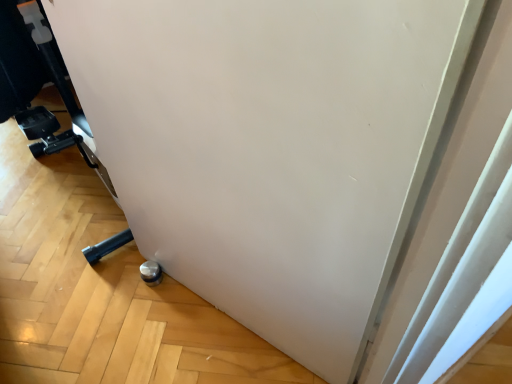
Where is `metallic silver caster at lower left`? metallic silver caster at lower left is located at coordinates (34, 79).

What do you see at coordinates (34, 79) in the screenshot?
I see `metallic silver caster at lower left` at bounding box center [34, 79].

You are a GUI agent. You are given a task and a screenshot of the screen. Output one action in this format:
    pyautogui.click(x=<x>, y=<y>)
    Task: Click on the metallic silver wheel at lower left
    The height and width of the screenshot is (384, 512).
    Given the screenshot: What is the action you would take?
    pyautogui.click(x=151, y=273)

This screenshot has width=512, height=384. What do you see at coordinates (151, 273) in the screenshot? I see `metallic silver wheel at lower left` at bounding box center [151, 273].

The height and width of the screenshot is (384, 512). Find the location of `metallic silver caster at lower left`. metallic silver caster at lower left is located at coordinates (34, 79).

Considering the relative positions of metallic silver caster at lower left and metallic silver wheel at lower left in the image provided, is metallic silver caster at lower left to the left or to the right of metallic silver wheel at lower left?

In the image, metallic silver caster at lower left appears on the left side of metallic silver wheel at lower left.

Considering the positions of objects metallic silver caster at lower left and metallic silver wheel at lower left in the image provided, who is behind, metallic silver caster at lower left or metallic silver wheel at lower left?

metallic silver wheel at lower left is further from the camera.

Is point (55, 68) more distant than point (142, 278)?

That is True.

From the image's perspective, is metallic silver caster at lower left above metallic silver wheel at lower left?

Yes, from the image's perspective, metallic silver caster at lower left is over metallic silver wheel at lower left.

From a real-world perspective, which object stands above the other?

metallic silver caster at lower left.

Which of these two, metallic silver caster at lower left or metallic silver wheel at lower left, is thinner?

With smaller width is metallic silver wheel at lower left.

Considering the sizes of metallic silver caster at lower left and metallic silver wheel at lower left in the image, is metallic silver caster at lower left taller or shorter than metallic silver wheel at lower left?

Clearly, metallic silver caster at lower left is taller compared to metallic silver wheel at lower left.

Between metallic silver caster at lower left and metallic silver wheel at lower left, which one has smaller size?

Smaller between the two is metallic silver wheel at lower left.

Which is correct: metallic silver caster at lower left is inside metallic silver wheel at lower left, or outside of it?

metallic silver caster at lower left exists outside the volume of metallic silver wheel at lower left.

From the picture: Is there a large distance between metallic silver caster at lower left and metallic silver wheel at lower left?

That's not correct — metallic silver caster at lower left is a little close to metallic silver wheel at lower left.

Could you tell me if metallic silver caster at lower left is turned towards metallic silver wheel at lower left?

No, metallic silver caster at lower left does not turn towards metallic silver wheel at lower left.

Image resolution: width=512 pixels, height=384 pixels. In order to click on furniture above the metallic silver wheel at lower left (from the image's perspective) in this screenshot , I will do `click(34, 79)`.

Between metallic silver wheel at lower left and metallic silver caster at lower left, which one appears on the right side from the viewer's perspective?

From the viewer's perspective, metallic silver wheel at lower left appears more on the right side.

Is metallic silver wheel at lower left in front of or behind metallic silver caster at lower left in the image?

metallic silver wheel at lower left is positioned farther from the viewer than metallic silver caster at lower left.

Is point (158, 273) closer to camera compared to point (73, 112)?

Yes, point (158, 273) is closer to viewer.

From the image's perspective, is metallic silver wheel at lower left located above metallic silver caster at lower left?

No, from the image's perspective, metallic silver wheel at lower left is not over metallic silver caster at lower left.

From a real-world perspective, is metallic silver wheel at lower left located higher than metallic silver caster at lower left?

No, from a real-world perspective, metallic silver wheel at lower left is not above metallic silver caster at lower left.

Is metallic silver wheel at lower left thinner than metallic silver caster at lower left?

Indeed, metallic silver wheel at lower left has a lesser width compared to metallic silver caster at lower left.

Does metallic silver wheel at lower left have a greater height compared to metallic silver caster at lower left?

Incorrect, the height of metallic silver wheel at lower left is not larger of that of metallic silver caster at lower left.

Who is smaller, metallic silver wheel at lower left or metallic silver caster at lower left?

Smaller between the two is metallic silver wheel at lower left.

Is metallic silver wheel at lower left not inside metallic silver caster at lower left?

metallic silver wheel at lower left lies outside metallic silver caster at lower left's area.

Are metallic silver wheel at lower left and metallic silver caster at lower left making contact?

metallic silver wheel at lower left is not next to metallic silver caster at lower left, and they're not touching.

Is metallic silver wheel at lower left oriented away from metallic silver caster at lower left?

metallic silver wheel at lower left does not have its back to metallic silver caster at lower left.

Can you tell me how much metallic silver wheel at lower left and metallic silver caster at lower left differ in facing direction?

The facing directions of metallic silver wheel at lower left and metallic silver caster at lower left are 107 degrees apart.

You are a GUI agent. You are given a task and a screenshot of the screen. Output one action in this format:
    pyautogui.click(x=<x>, y=<y>)
    Task: Click on the furniture that is above the metallic silver wheel at lower left (from the image's perspective)
    This screenshot has height=384, width=512.
    Given the screenshot: What is the action you would take?
    pyautogui.click(x=34, y=79)

Locate an element on the screen. This screenshot has height=384, width=512. furniture above the metallic silver wheel at lower left (from the image's perspective) is located at coordinates click(x=34, y=79).

You are a GUI agent. You are given a task and a screenshot of the screen. Output one action in this format:
    pyautogui.click(x=<x>, y=<y>)
    Task: Click on the wheel behind the metallic silver caster at lower left
    The width and height of the screenshot is (512, 384).
    Given the screenshot: What is the action you would take?
    pyautogui.click(x=151, y=273)